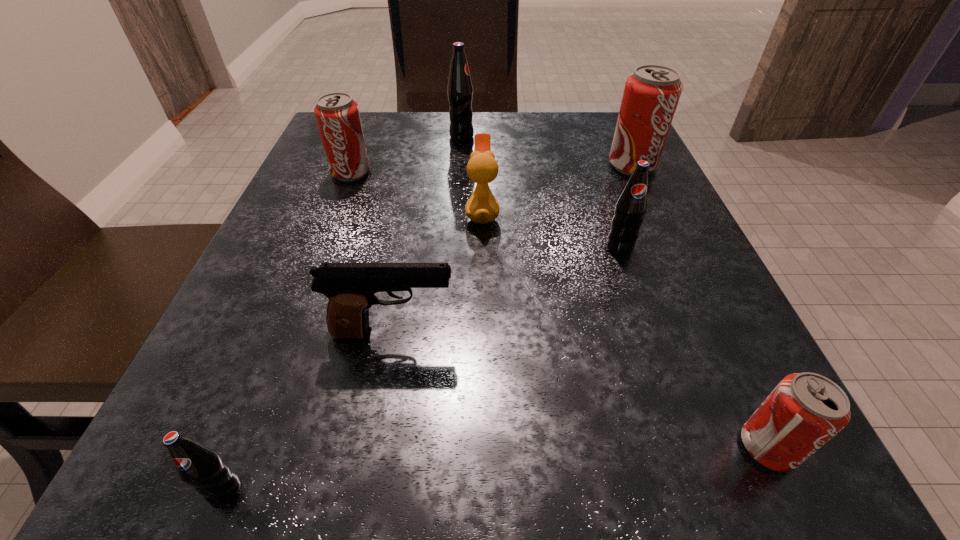
At what (x,y) coordinates should I click in order to perform the action: click on free spot between the fourth farthest object and the second smallest black pop. Please return your answer as a coordinate pair (x, y). Image resolution: width=960 pixels, height=540 pixels. Looking at the image, I should click on (551, 230).

This screenshot has width=960, height=540. I want to click on vacant area that lies between the duck and the biggest pink soda can, so click(558, 189).

Find the location of a particular element. This screenshot has width=960, height=540. object that is the seventh closest to the pistol is located at coordinates (460, 90).

At what (x,y) coordinates should I click in order to perform the action: click on the seventh closest object to the fifth nearest object. Please return your answer as a coordinate pair (x, y). Image resolution: width=960 pixels, height=540 pixels. Looking at the image, I should click on (199, 466).

Locate which pop is the third closest to the leftmost pink soda can. Please provide its 2D coordinates. Your answer should be formatted as a tuple, i.e. [(x, y)], where the tuple contains the x and y coordinates of a point satisfying the conditions above.

[(651, 94)]

Point out which pop is positioned as the fifth nearest to the second smallest black pop. Please provide its 2D coordinates. Your answer should be formatted as a tuple, i.e. [(x, y)], where the tuple contains the x and y coordinates of a point satisfying the conditions above.

[(199, 466)]

The height and width of the screenshot is (540, 960). I want to click on black pop that is the third closest to the second biggest pink soda can, so coord(199,466).

Identify which black pop is the second nearest to the fourth farthest object. Please provide its 2D coordinates. Your answer should be formatted as a tuple, i.e. [(x, y)], where the tuple contains the x and y coordinates of a point satisfying the conditions above.

[(460, 90)]

Locate which pink soda can is the second closest to the biggest pink soda can. Please provide its 2D coordinates. Your answer should be formatted as a tuple, i.e. [(x, y)], where the tuple contains the x and y coordinates of a point satisfying the conditions above.

[(805, 410)]

Identify the location of pink soda can object that ranks as the closest to the third nearest object. (805, 410).